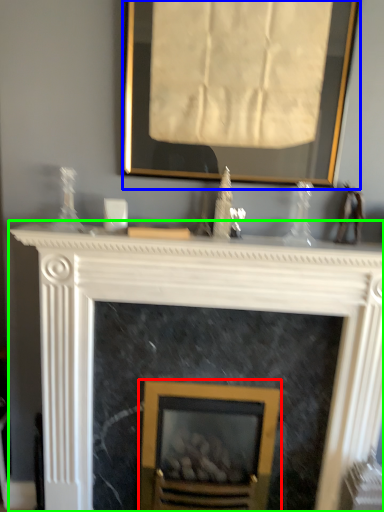
Question: Which is farther away from fireplace (highlighted by a red box)? picture frame (highlighted by a blue box) or fireplace (highlighted by a green box)?

Choices:
 (A) picture frame
 (B) fireplace

Answer: (A)